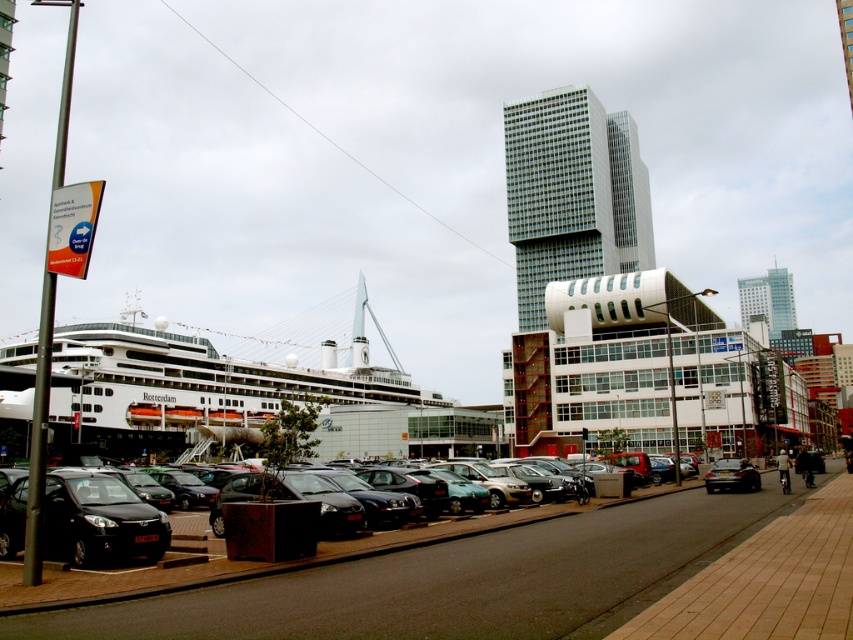
Question: Is shiny black cars at lower left thinner than white glossy cruise ship at lower left?

Choices:
 (A) no
 (B) yes

Answer: (B)

Question: Is the position of white glossy cruise ship at lower left more distant than that of shiny black hatchback at lower left?

Choices:
 (A) yes
 (B) no

Answer: (B)

Question: Which point appears farthest from the camera in this image?

Choices:
 (A) (67, 541)
 (B) (392, 369)
 (C) (86, 614)

Answer: (B)

Question: Which object is closer to the camera taking this photo?

Choices:
 (A) shiny black hatchback at lower left
 (B) white glossy cruise ship at lower left

Answer: (B)

Question: Is shiny black cars at lower left wider than white glossy cruise ship at lower left?

Choices:
 (A) no
 (B) yes

Answer: (A)

Question: Which object is closer to the camera taking this photo?

Choices:
 (A) shiny black cars at lower left
 (B) white glossy cruise ship at lower left
 (C) shiny black hatchback at lower left

Answer: (A)